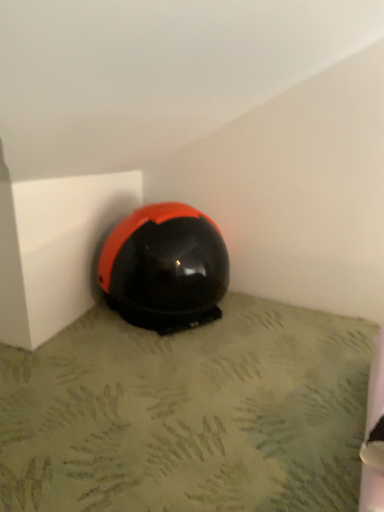
Question: Is point (46, 502) closer or farther from the camera than point (97, 270)?

Choices:
 (A) closer
 (B) farther

Answer: (A)

Question: Looking at their shapes, would you say black matte helmet at center is wider or thinner than glossy black helmet at lower center?

Choices:
 (A) thin
 (B) wide

Answer: (B)

Question: Considering the relative positions of black matte helmet at center and glossy black helmet at lower center in the image provided, is black matte helmet at center to the left or to the right of glossy black helmet at lower center?

Choices:
 (A) right
 (B) left

Answer: (A)

Question: Is point (170, 300) closer or farther from the camera than point (326, 507)?

Choices:
 (A) farther
 (B) closer

Answer: (A)

Question: From a real-world perspective, is glossy black helmet at lower center physically located above or below black matte helmet at center?

Choices:
 (A) above
 (B) below

Answer: (A)

Question: In terms of height, does glossy black helmet at lower center look taller or shorter compared to black matte helmet at center?

Choices:
 (A) short
 (B) tall

Answer: (B)

Question: In terms of width, does glossy black helmet at lower center look wider or thinner when compared to black matte helmet at center?

Choices:
 (A) wide
 (B) thin

Answer: (B)